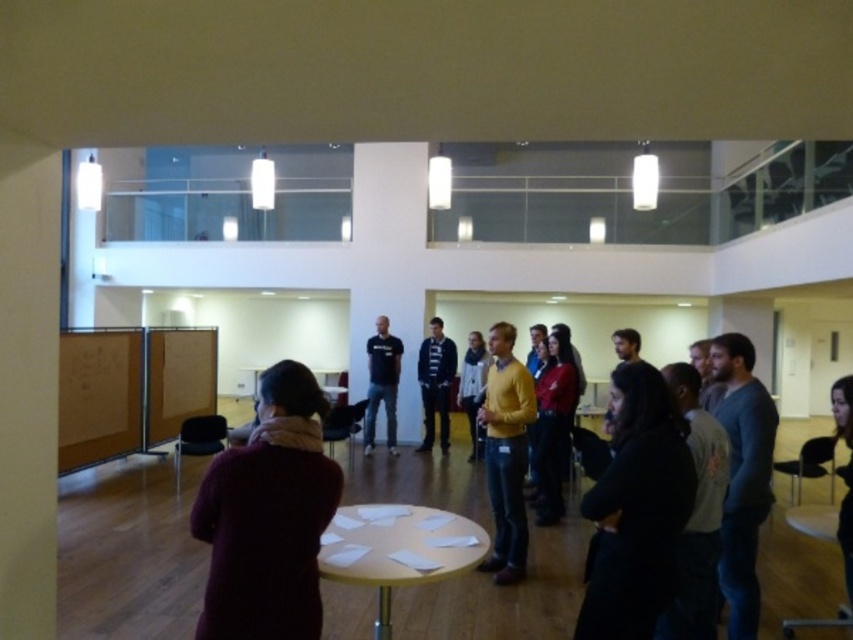
Which is more to the right, maroon woolen sweater at center or dark blue sweater at center?

Positioned to the right is dark blue sweater at center.

Does maroon woolen sweater at center come in front of dark blue sweater at center?

Yes.

Which is in front, point (300, 612) or point (442, 429)?

Point (300, 612) is in front.

At what (x,y) coordinates should I click in order to perform the action: click on maroon woolen sweater at center. Please return your answer as a coordinate pair (x, y). This screenshot has width=853, height=640. Looking at the image, I should click on point(268,516).

Is point (448, 358) closer to viewer compared to point (387, 376)?

Yes, point (448, 358) is closer to viewer.

Does dark blue sweater at center have a lesser height compared to black matte shirt at center?

No.

What are the coordinates of `dark blue sweater at center` in the screenshot? It's located at (434, 381).

Where is `dark blue sweater at center`? dark blue sweater at center is located at coordinates (434, 381).

Can you confirm if light brown wooden table at center is positioned to the left of dark blue sweater at center?

Indeed, light brown wooden table at center is positioned on the left side of dark blue sweater at center.

Is point (352, 531) positioned behind point (445, 378)?

That is False.

Where is `light brown wooden table at center`? Image resolution: width=853 pixels, height=640 pixels. light brown wooden table at center is located at coordinates (396, 552).